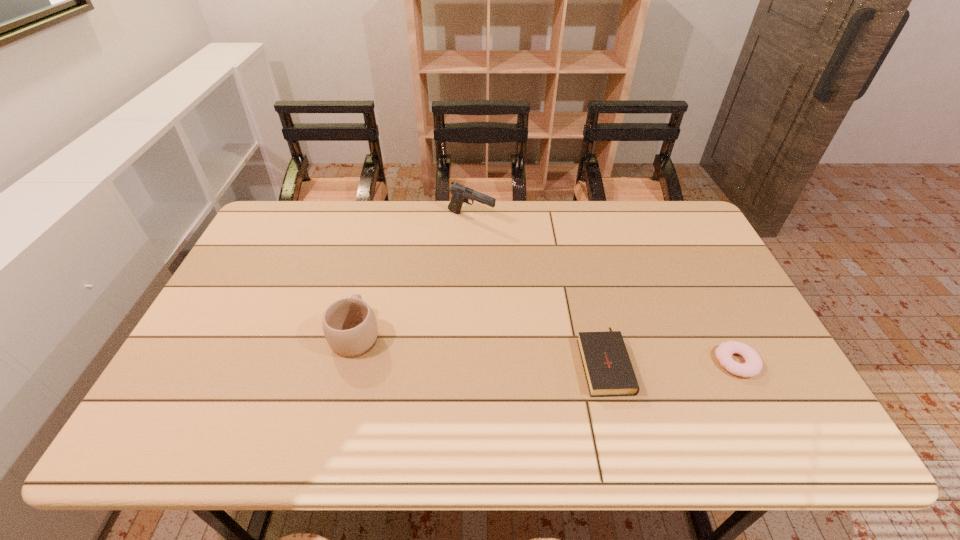
The height and width of the screenshot is (540, 960). I want to click on vacant space located 0.220m on the side of the leftmost object with the handle, so click(x=375, y=258).

This screenshot has height=540, width=960. Identify the location of blank space located on the side of the leftmost object with the handle. [365, 298].

The width and height of the screenshot is (960, 540). Identify the location of vacant space positioned on the left of the third tallest object. (497, 360).

This screenshot has height=540, width=960. Find the location of `vacant space located 0.330m on the back of the doughnut`. vacant space located 0.330m on the back of the doughnut is located at coordinates (685, 260).

Locate an element on the screen. object located at the far edge is located at coordinates (460, 194).

Where is `object present at the right edge`? This screenshot has height=540, width=960. object present at the right edge is located at coordinates (753, 364).

Where is `vacant space at the far edge of the desktop`? The width and height of the screenshot is (960, 540). vacant space at the far edge of the desktop is located at coordinates (416, 207).

Locate an element on the screen. vacant point at the near edge is located at coordinates (328, 423).

The width and height of the screenshot is (960, 540). What are the coordinates of `free location at the left edge of the desktop` in the screenshot? It's located at (278, 252).

At what (x,y) coordinates should I click in order to perform the action: click on free space at the right edge. Please return your answer as a coordinate pair (x, y). Image resolution: width=960 pixels, height=540 pixels. Looking at the image, I should click on (709, 269).